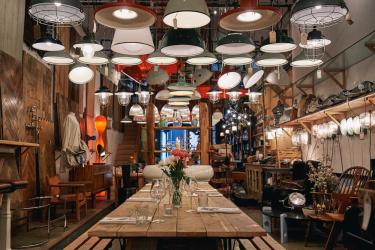
Locate an element on the screen. This screenshot has height=250, width=375. napkins and utensils is located at coordinates (113, 218), (229, 209), (216, 195), (144, 198), (143, 190), (205, 189), (147, 183).